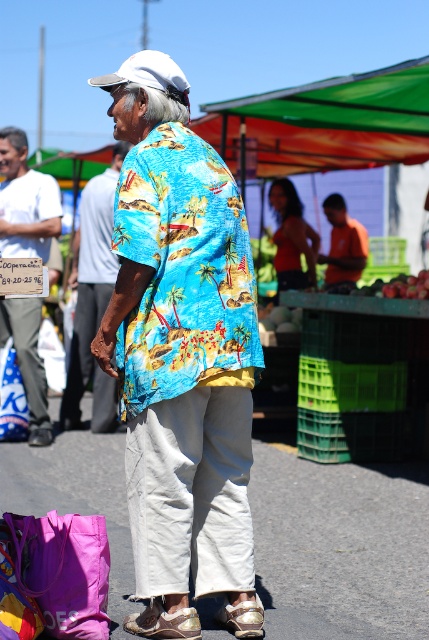
You are a photographer standing at the market entrance. You want to take a photo that includes both the green fabric canopy at upper center and the shiny blue shirt at center. Which object should you adjust your camera angle to focus on first to ensure both are in frame?

The green fabric canopy at upper center is not as tall as the shiny blue shirt at center, so you should focus on the shiny blue shirt at center first to ensure both are in frame.